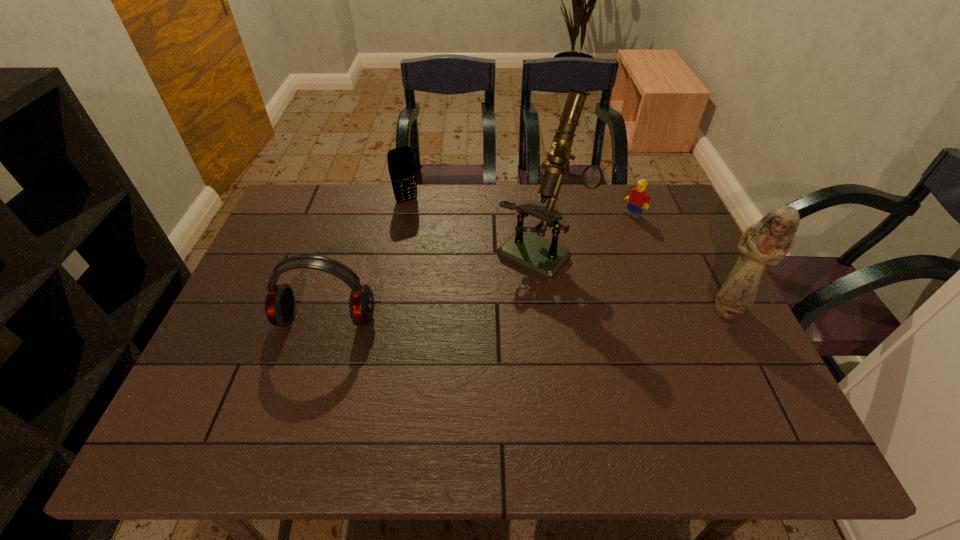
The image size is (960, 540). I want to click on earphone, so click(x=280, y=302).

You are a GUI agent. You are given a task and a screenshot of the screen. Output one action in this format:
    pyautogui.click(x=<x>, y=<y>)
    Task: Click on the figurine
    The width and height of the screenshot is (960, 540).
    Given the screenshot: What is the action you would take?
    point(765,243)

Identify the location of the fourth shortest object. The width and height of the screenshot is (960, 540). (765, 243).

You are a GUI agent. You are given a task and a screenshot of the screen. Output one action in this format:
    pyautogui.click(x=<x>, y=<y>)
    Task: Click on the cellular telephone
    The height and width of the screenshot is (540, 960).
    Given the screenshot: What is the action you would take?
    pyautogui.click(x=401, y=163)

The height and width of the screenshot is (540, 960). In order to click on the second object from right to left in this screenshot , I will do `click(638, 198)`.

At what (x,y) coordinates should I click in order to perform the action: click on the shortest object. Please return your answer as a coordinate pair (x, y). The width and height of the screenshot is (960, 540). Looking at the image, I should click on pos(638,198).

Where is `the third object from right to left`? The width and height of the screenshot is (960, 540). the third object from right to left is located at coordinates (544, 258).

Locate an element on the screen. The width and height of the screenshot is (960, 540). the third nearest object is located at coordinates (544, 258).

Identify the location of vacant space situated 0.070m on the ear cups of the earphone. (314, 360).

This screenshot has height=540, width=960. I want to click on vacant space located 0.060m on the front-facing side of the fourth shortest object, so click(x=745, y=347).